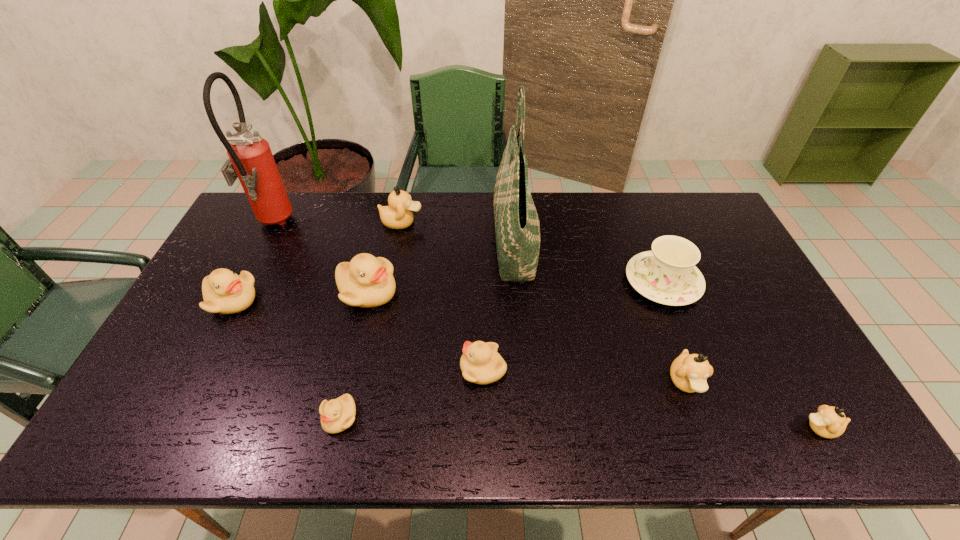
Find the location of a particular element. This screenshot has height=540, width=960. free space between the fifth duckling from left to right and the leftmost tan duckling is located at coordinates (443, 296).

In order to click on object that stands as the fourth closest to the biggest yellow duckling in this screenshot , I will do `click(338, 414)`.

Select which object is the ninth closest to the green tote bag. Please provide its 2D coordinates. Your answer should be formatted as a tuple, i.e. [(x, y)], where the tuple contains the x and y coordinates of a point satisfying the conditions above.

[(251, 160)]

Identify the location of duckling that is the third closest to the leftmost duckling. (398, 215).

Identify which duckling is the fourth closest to the chinaware. Please provide its 2D coordinates. Your answer should be formatted as a tuple, i.e. [(x, y)], where the tuple contains the x and y coordinates of a point satisfying the conditions above.

[(398, 215)]

Select which tan duckling appears as the second closest to the biggest yellow duckling. Please provide its 2D coordinates. Your answer should be formatted as a tuple, i.e. [(x, y)], where the tuple contains the x and y coordinates of a point satisfying the conditions above.

[(689, 373)]

The height and width of the screenshot is (540, 960). I want to click on tan duckling that can be found as the closest to the biggest yellow duckling, so click(x=398, y=215).

Where is `yellow duckling identified as the third closest to the rightmost tan duckling`? The width and height of the screenshot is (960, 540). yellow duckling identified as the third closest to the rightmost tan duckling is located at coordinates (366, 281).

Identify which yellow duckling is the third nearest to the fire extinguisher. Please provide its 2D coordinates. Your answer should be formatted as a tuple, i.e. [(x, y)], where the tuple contains the x and y coordinates of a point satisfying the conditions above.

[(338, 414)]

The image size is (960, 540). What are the coordinates of `vacant region that satisfies the following two spatial constraints: 1. on the handle side of the chinaware; 2. on the beak of the shortest object` in the screenshot? It's located at (716, 417).